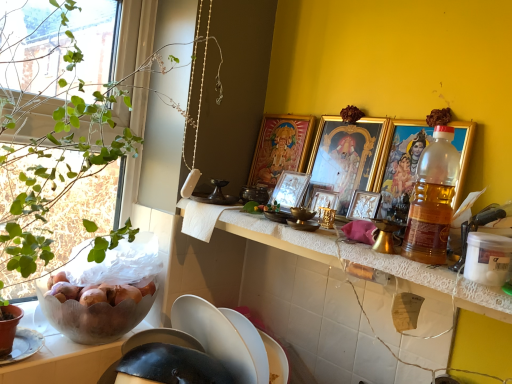
What do you see at coordinates (320, 197) in the screenshot? I see `metallic silver picture frame at center, which is the 3th picture frame in back-to-front order` at bounding box center [320, 197].

This screenshot has width=512, height=384. Describe the element at coordinates (290, 189) in the screenshot. I see `metallic silver picture frame at center, the first picture frame in the back-to-front sequence` at that location.

Locate an element on the screen. Image resolution: width=512 pixels, height=384 pixels. green leafy plant at left is located at coordinates (60, 170).

The height and width of the screenshot is (384, 512). What do you see at coordinates (346, 155) in the screenshot?
I see `gold metallic picture frame at upper center, the fourth picture frame positioned from the back` at bounding box center [346, 155].

This screenshot has height=384, width=512. In order to click on metallic silver picture frame at center, positioned as the third picture frame in front-to-back order in this screenshot , I will do `click(320, 197)`.

From a real-world perspective, is translucent plastic bottle at right above or below metallic silver picture frame at center, which appears as the 5th picture frame when viewed from the front?

translucent plastic bottle at right is above metallic silver picture frame at center, which appears as the 5th picture frame when viewed from the front.

Is translucent plastic bottle at right oriented away from metallic silver picture frame at center, the first picture frame in the back-to-front sequence?

No, translucent plastic bottle at right is not facing away from metallic silver picture frame at center, the first picture frame in the back-to-front sequence.

Which point is more forward, (437, 194) or (281, 180)?

The point (437, 194) is more forward.

Which of these two, translucent plastic bottle at right or metallic silver picture frame at center, the first picture frame in the back-to-front sequence, is thinner?

Result: With smaller width is metallic silver picture frame at center, the first picture frame in the back-to-front sequence.

Between metallic silver picture frame at center, the first picture frame in the back-to-front sequence, and metallic silver picture frame at center, which is the 3th picture frame in back-to-front order, which one has smaller size?

metallic silver picture frame at center, which is the 3th picture frame in back-to-front order.

How different are the orientations of metallic silver picture frame at center, which appears as the 5th picture frame when viewed from the front, and metallic silver picture frame at center, positioned as the third picture frame in front-to-back order, in degrees?

metallic silver picture frame at center, which appears as the 5th picture frame when viewed from the front, and metallic silver picture frame at center, positioned as the third picture frame in front-to-back order, are facing 0.000416 degrees away from each other.

Is metallic silver picture frame at center, the first picture frame in the back-to-front sequence, turned away from metallic silver picture frame at center, which is the 3th picture frame in back-to-front order?

metallic silver picture frame at center, the first picture frame in the back-to-front sequence, does not have its back to metallic silver picture frame at center, which is the 3th picture frame in back-to-front order.

From a real-world perspective, which is physically above, metallic silver picture frame at center, which appears as the 5th picture frame when viewed from the front, or metallic silver picture frame at center, positioned as the third picture frame in front-to-back order?

metallic silver picture frame at center, which appears as the 5th picture frame when viewed from the front, is physically above.

Is gold metallic picture frame at upper center, the 2th picture frame positioned from the front, oriented towards translucent plastic bottle at right?

No, gold metallic picture frame at upper center, the 2th picture frame positioned from the front, is not turned towards translucent plastic bottle at right.

Which is nearer, (324, 150) or (421, 158)?

The point (421, 158) is in front.

Can you confirm if gold metallic picture frame at upper center, the fourth picture frame positioned from the back, is wider than translucent plastic bottle at right?

Incorrect, the width of gold metallic picture frame at upper center, the fourth picture frame positioned from the back, does not surpass that of translucent plastic bottle at right.

Considering their positions, is gold metallic picture frame at upper center, the 2th picture frame positioned from the front, located in front of or behind translucent plastic bottle at right?

Visually, gold metallic picture frame at upper center, the 2th picture frame positioned from the front, is located behind translucent plastic bottle at right.

Would you say green leafy plant at left is a long distance from gold metallic picture frame at upper center, the 2th picture frame positioned from the front?

That's not correct — green leafy plant at left is a little close to gold metallic picture frame at upper center, the 2th picture frame positioned from the front.

Considering the positions of objects green leafy plant at left and gold metallic picture frame at upper center, the fourth picture frame positioned from the back, in the image provided, who is more to the right, green leafy plant at left or gold metallic picture frame at upper center, the fourth picture frame positioned from the back,?

From the viewer's perspective, gold metallic picture frame at upper center, the fourth picture frame positioned from the back, appears more on the right side.

From a real-world perspective, is green leafy plant at left physically located above or below gold metallic picture frame at upper center, the fourth picture frame positioned from the back?

green leafy plant at left is below gold metallic picture frame at upper center, the fourth picture frame positioned from the back.

Which of these two, green leafy plant at left or gold metallic picture frame at upper center, the fourth picture frame positioned from the back, stands shorter?

gold metallic picture frame at upper center, the fourth picture frame positioned from the back.

In terms of height, does white lace countertop at center look taller or shorter compared to green leafy plant at left?

white lace countertop at center is shorter than green leafy plant at left.

Who is more distant, white lace countertop at center or green leafy plant at left?

white lace countertop at center is behind.

Is white lace countertop at center next to green leafy plant at left and touching it?

No, white lace countertop at center is not touching green leafy plant at left.

From the image's perspective, between white lace countertop at center and green leafy plant at left, which one is located above?

From the image's view, green leafy plant at left is above.

Is gold-framed picture at right, which is the 1th picture frame in front-to-back order, shorter than white lace countertop at center?

No, gold-framed picture at right, which is the 1th picture frame in front-to-back order, is not shorter than white lace countertop at center.

From a real-world perspective, is gold-framed picture at right, arranged as the 5th picture frame when viewed from the back, located beneath white lace countertop at center?

No, from a real-world perspective, gold-framed picture at right, arranged as the 5th picture frame when viewed from the back, is not under white lace countertop at center.

Would you consider gold-framed picture at right, which is the 1th picture frame in front-to-back order, to be distant from white lace countertop at center?

gold-framed picture at right, which is the 1th picture frame in front-to-back order, is near white lace countertop at center, not far away.

From the image's perspective, is metallic silver picture frame at center, positioned as the third picture frame in front-to-back order, below gold-framed picture at center, the second picture frame in the back-to-front sequence?

Yes, from the image's perspective, metallic silver picture frame at center, positioned as the third picture frame in front-to-back order, is below gold-framed picture at center, the second picture frame in the back-to-front sequence.

Would you say metallic silver picture frame at center, positioned as the third picture frame in front-to-back order, is a long distance from gold-framed picture at center, arranged as the fourth picture frame when viewed from the front?

No.

From a real-world perspective, which is physically below, metallic silver picture frame at center, which is the 3th picture frame in back-to-front order, or gold-framed picture at center, arranged as the fourth picture frame when viewed from the front?

In real-world perspective, metallic silver picture frame at center, which is the 3th picture frame in back-to-front order, is lower.

You are a GUI agent. You are given a task and a screenshot of the screen. Output one action in this format:
    pyautogui.click(x=<x>, y=<y>)
    Task: Click on the 5th picture frame behind the translucent plastic bottle at right, starting your count from the anchor
    
    Given the screenshot: What is the action you would take?
    tap(290, 189)

At what (x,y) coordinates should I click in order to perform the action: click on the 1st picture frame to the left of the metallic silver picture frame at center, which is the 3th picture frame in back-to-front order, counting from the anchor's position. Please return your answer as a coordinate pair (x, y). Image resolution: width=512 pixels, height=384 pixels. Looking at the image, I should click on (290, 189).

Looking at the image, which one is located closer to gold metallic picture frame at upper center, the 2th picture frame positioned from the front, metallic silver picture frame at center, which is the 3th picture frame in back-to-front order, or translucent plastic bottle at right?

metallic silver picture frame at center, which is the 3th picture frame in back-to-front order, is positioned closer to the anchor gold metallic picture frame at upper center, the 2th picture frame positioned from the front.

Looking at the image, which one is located closer to metallic silver picture frame at center, which appears as the 5th picture frame when viewed from the front, gold metallic picture frame at upper center, the 2th picture frame positioned from the front, or translucent plastic bottle at right?

gold metallic picture frame at upper center, the 2th picture frame positioned from the front, lies closer to metallic silver picture frame at center, which appears as the 5th picture frame when viewed from the front, than the other object.

Considering their positions, is metallic silver picture frame at center, which appears as the 5th picture frame when viewed from the front, positioned closer to gold-framed picture at right, which is the 1th picture frame in front-to-back order, than metallic silver picture frame at center, which is the 3th picture frame in back-to-front order?

metallic silver picture frame at center, which is the 3th picture frame in back-to-front order.

Which object lies further to the anchor point metallic silver picture frame at center, positioned as the third picture frame in front-to-back order, gold-framed picture at right, arranged as the 5th picture frame when viewed from the back, or translucent plastic bottle at right?

translucent plastic bottle at right.

Looking at the image, which one is located closer to gold metallic picture frame at upper center, the 2th picture frame positioned from the front, metallic silver picture frame at center, the first picture frame in the back-to-front sequence, or gold-framed picture at center, arranged as the fourth picture frame when viewed from the front?

The object closer to gold metallic picture frame at upper center, the 2th picture frame positioned from the front, is metallic silver picture frame at center, the first picture frame in the back-to-front sequence.

Looking at the image, which one is located further to white lace countertop at center, green leafy plant at left or metallic silver picture frame at center, positioned as the third picture frame in front-to-back order?

Among the two, green leafy plant at left is located further to white lace countertop at center.

Based on their spatial positions, is gold-framed picture at center, the second picture frame in the back-to-front sequence, or metallic silver picture frame at center, which appears as the 5th picture frame when viewed from the front, further from gold-framed picture at right, arranged as the 5th picture frame when viewed from the back?

The object further to gold-framed picture at right, arranged as the 5th picture frame when viewed from the back, is gold-framed picture at center, the second picture frame in the back-to-front sequence.

Based on their spatial positions, is white lace countertop at center or green leafy plant at left closer to metallic silver picture frame at center, positioned as the third picture frame in front-to-back order?

white lace countertop at center is positioned closer to the anchor metallic silver picture frame at center, positioned as the third picture frame in front-to-back order.

Locate an element on the screen. picture frame between gold-framed picture at right, arranged as the 5th picture frame when viewed from the back, and metallic silver picture frame at center, positioned as the third picture frame in front-to-back order, in the front-back direction is located at coordinates (346, 155).

This screenshot has height=384, width=512. I want to click on picture frame between white lace countertop at center and gold metallic picture frame at upper center, the fourth picture frame positioned from the back, in the front-back direction, so click(400, 161).

Where is `bottle located between green leafy plant at left and gold-framed picture at right, which is the 1th picture frame in front-to-back order, in the left-right direction`? bottle located between green leafy plant at left and gold-framed picture at right, which is the 1th picture frame in front-to-back order, in the left-right direction is located at coordinates (432, 200).

Locate an element on the screen. This screenshot has height=384, width=512. bottle between white lace countertop at center and gold-framed picture at center, the second picture frame in the back-to-front sequence, along the z-axis is located at coordinates (432, 200).